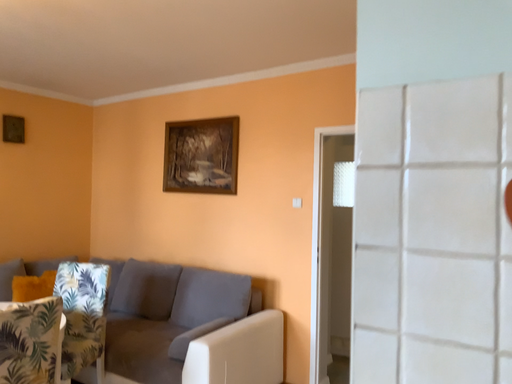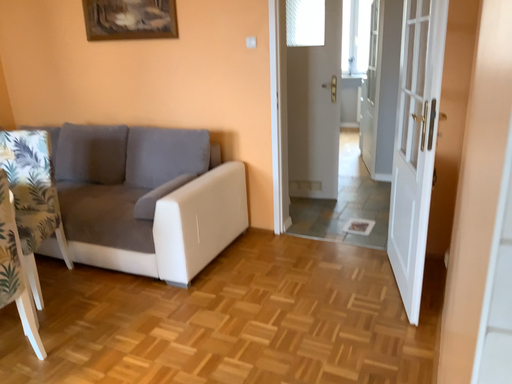
Question: Which way did the camera rotate in the video?

Choices:
 (A) rotated upward
 (B) rotated downward

Answer: (B)